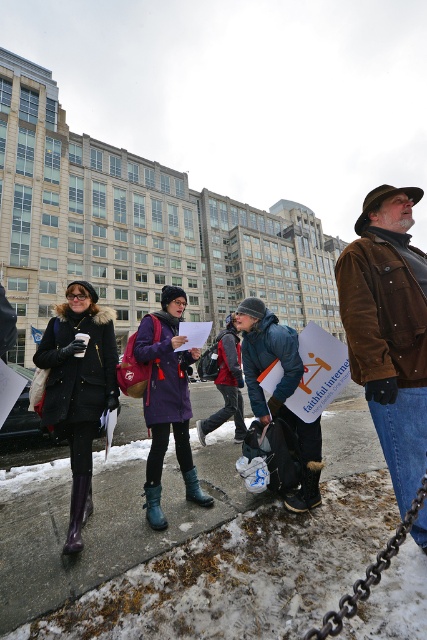
You are a photographer trying to capture a photo of the blue denim jacket at center and the black metal chain at lower right. Which object will appear larger in your photo?

The blue denim jacket at center will appear larger in the photo because it is bigger than the black metal chain at lower right.

You are a photographer standing at the edge of the group. You want to take a photo that includes both the blue denim jacket at center and the black metal chain at lower right without any obstructions. Given that your camera has a maximum focus range of 6 feet, will you be able to capture both objects in focus at the same time?

The blue denim jacket at center is 5.87 feet away from the black metal chain at lower right. Since the distance between them is within the camera maximum focus range of 6 feet, you can capture both objects in focus at the same time.